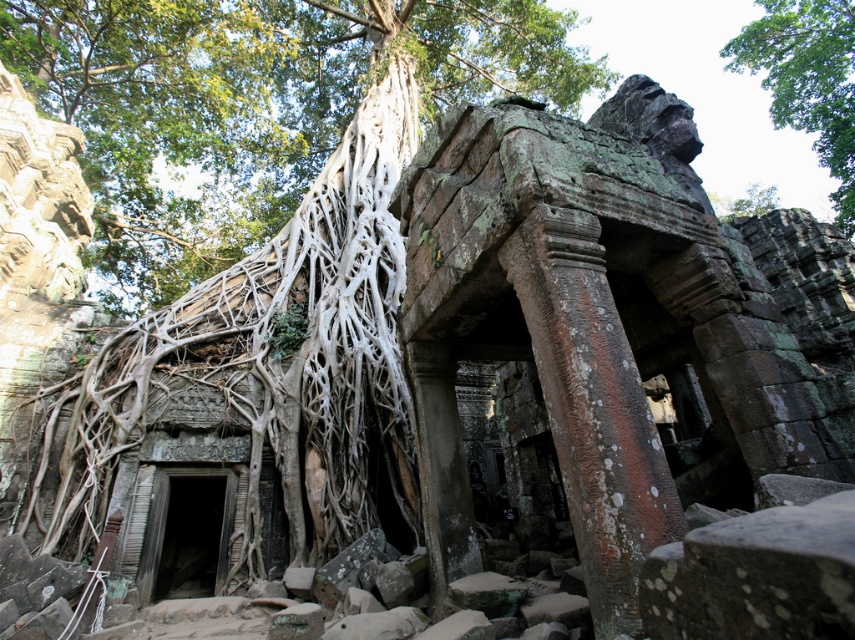
Is point (272, 230) farther from viewer compared to point (795, 90)?

No, it is in front of (795, 90).

Does white root at left appear on the right side of green leafy tree at upper center?

In fact, white root at left is to the left of green leafy tree at upper center.

Which is in front, point (75, 81) or point (789, 45)?

Point (75, 81) is in front.

The height and width of the screenshot is (640, 855). I want to click on white root at left, so click(174, 125).